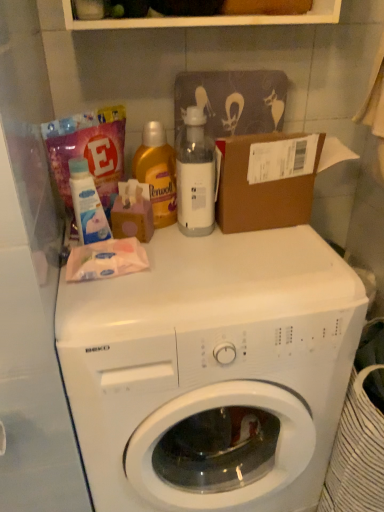
Question: From a real-world perspective, is white plastic bottle at center physically below white glossy washing machine at center?

Choices:
 (A) no
 (B) yes

Answer: (A)

Question: Is white plastic bottle at center taller than white glossy washing machine at center?

Choices:
 (A) yes
 (B) no

Answer: (B)

Question: Is white plastic bottle at center shorter than white glossy washing machine at center?

Choices:
 (A) yes
 (B) no

Answer: (A)

Question: Is white plastic bottle at center positioned in front of white glossy washing machine at center?

Choices:
 (A) no
 (B) yes

Answer: (A)

Question: Does white plastic bottle at center have a lesser width compared to white glossy washing machine at center?

Choices:
 (A) yes
 (B) no

Answer: (A)

Question: From the image's perspective, is white glossy washing machine at center positioned above or below white plastic bottle at center?

Choices:
 (A) below
 (B) above

Answer: (A)

Question: Is white glossy washing machine at center wider or thinner than white plastic bottle at center?

Choices:
 (A) wide
 (B) thin

Answer: (A)

Question: Based on their sizes in the image, would you say white glossy washing machine at center is bigger or smaller than white plastic bottle at center?

Choices:
 (A) small
 (B) big

Answer: (B)

Question: Is white glossy washing machine at center to the left or to the right of white plastic bottle at center in the image?

Choices:
 (A) left
 (B) right

Answer: (B)

Question: Looking at the image, does yellow liquid detergent at upper center, which appears as the first cleaning product when viewed from the right, seem bigger or smaller compared to pink polka dot tissue box at upper center?

Choices:
 (A) small
 (B) big

Answer: (B)

Question: From their relative heights in the image, would you say yellow liquid detergent at upper center, which appears as the first cleaning product when viewed from the right, is taller or shorter than pink polka dot tissue box at upper center?

Choices:
 (A) tall
 (B) short

Answer: (A)

Question: From the image's perspective, is yellow liquid detergent at upper center, positioned as the second cleaning product in left-to-right order, located above or below pink polka dot tissue box at upper center?

Choices:
 (A) below
 (B) above

Answer: (B)

Question: In the image, is yellow liquid detergent at upper center, which appears as the first cleaning product when viewed from the right, on the left side or the right side of pink polka dot tissue box at upper center?

Choices:
 (A) left
 (B) right

Answer: (B)

Question: From a real-world perspective, relative to white glossy washing machine at center, is pink polka dot tissue box at upper center vertically above or below?

Choices:
 (A) below
 (B) above

Answer: (B)

Question: Is pink polka dot tissue box at upper center wider or thinner than white glossy washing machine at center?

Choices:
 (A) wide
 (B) thin

Answer: (B)